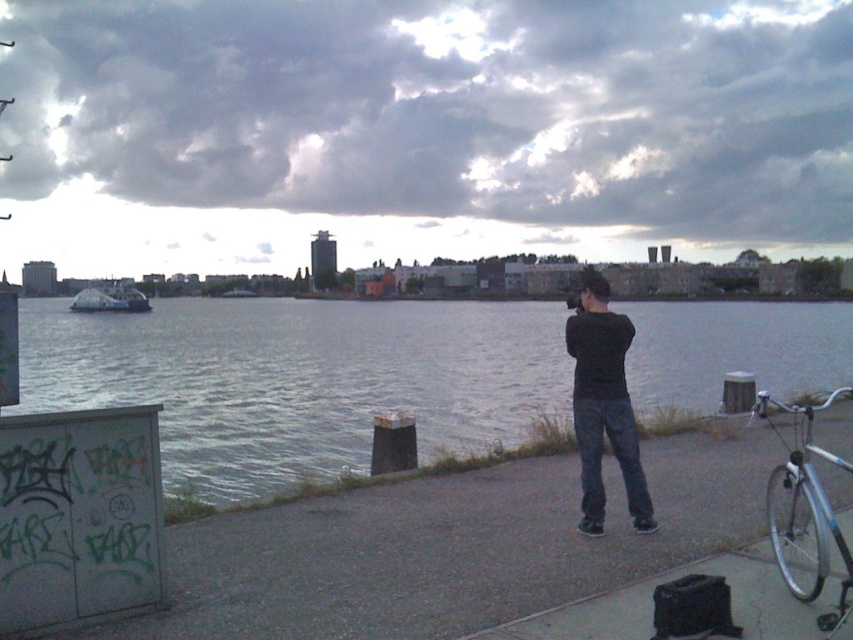
Who is more distant from viewer, (254, 417) or (634, 506)?

Positioned behind is point (254, 417).

Does gray water at center have a greater width compared to black matte pants at center?

Correct, the width of gray water at center exceeds that of black matte pants at center.

Which is in front, point (32, 349) or point (572, 401)?

Positioned in front is point (572, 401).

The image size is (853, 640). I want to click on gray water at center, so click(x=299, y=380).

Is silver metallic bicycle at right further to the viewer compared to metallic silver boat at center?

No, silver metallic bicycle at right is closer to the viewer.

Who is more distant from viewer, (782, 577) or (132, 307)?

The point (132, 307) is more distant.

Who is more forward, (787, 531) or (97, 298)?

Positioned in front is point (787, 531).

In order to click on silver metallic bicycle at right in this screenshot , I will do `click(804, 508)`.

Is point (581, 483) positioned in front of point (126, 305)?

That is True.

Who is more distant from viewer, (618, 436) or (103, 292)?

Point (103, 292)

Does point (637, 476) lie behind point (80, 300)?

No, it is not.

I want to click on black matte pants at center, so (602, 406).